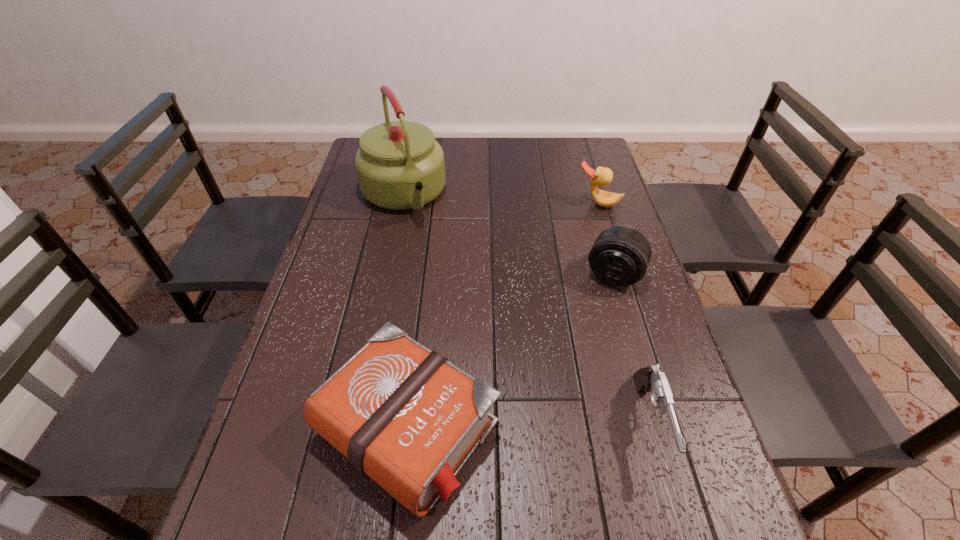
The width and height of the screenshot is (960, 540). I want to click on Bible, so click(405, 416).

At what (x,y) coordinates should I click in order to perform the action: click on gun. Please return your answer as a coordinate pair (x, y). This screenshot has width=960, height=540. Looking at the image, I should click on (x=650, y=379).

You are a GUI agent. You are given a task and a screenshot of the screen. Output one action in this format:
    pyautogui.click(x=<x>, y=<y>)
    Task: Click on the kettle
    
    Given the screenshot: What is the action you would take?
    pyautogui.click(x=400, y=166)

At what (x,y) coordinates should I click in order to perform the action: click on telephoto lens. Please return your answer as a coordinate pair (x, y). Image resolution: width=960 pixels, height=540 pixels. Looking at the image, I should click on (620, 256).

In order to click on duck in this screenshot , I will do `click(602, 176)`.

The height and width of the screenshot is (540, 960). Find the location of `free space located 0.210m on the right of the Bible`. free space located 0.210m on the right of the Bible is located at coordinates (602, 428).

At what (x,y) coordinates should I click in order to perform the action: click on free space located 0.140m at the spout of the kettle. Please return your answer as a coordinate pair (x, y). The width and height of the screenshot is (960, 540). Looking at the image, I should click on (429, 256).

Where is `vacant space situated 0.170m at the spout of the kettle`? vacant space situated 0.170m at the spout of the kettle is located at coordinates (432, 263).

Where is `free space located 0.120m at the spout of the kettle`? free space located 0.120m at the spout of the kettle is located at coordinates (427, 252).

You are a GUI agent. You are given a task and a screenshot of the screen. Output one action in this format:
    pyautogui.click(x=<x>, y=<y>)
    Task: Click on the free space located on the front-facing side of the telephoto lens
    The image size is (960, 540).
    Given the screenshot: What is the action you would take?
    pyautogui.click(x=597, y=308)